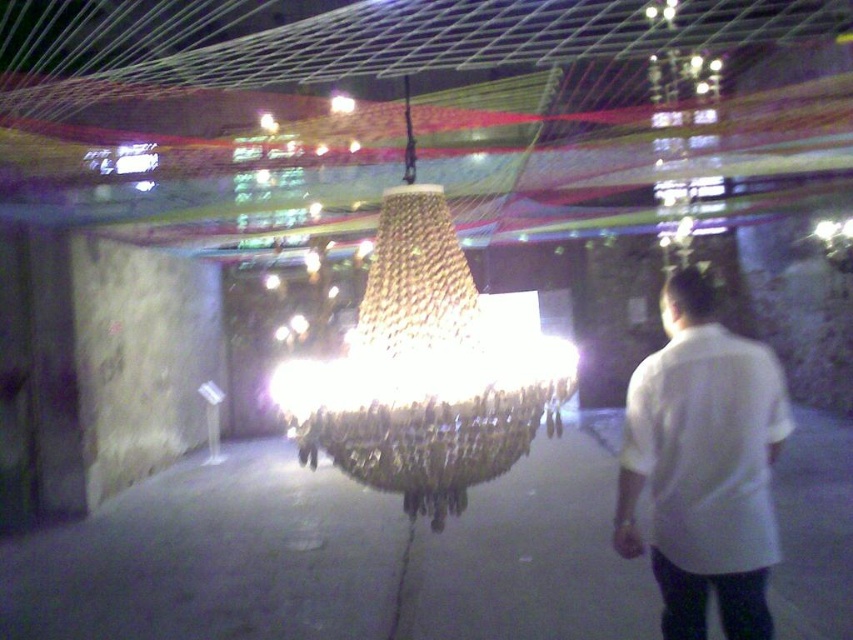
Question: Does iridescent glass chandelier at center appear on the right side of white cotton shirt at right?

Choices:
 (A) no
 (B) yes

Answer: (A)

Question: Does iridescent glass chandelier at center have a larger size compared to white cotton shirt at right?

Choices:
 (A) yes
 (B) no

Answer: (A)

Question: Does iridescent glass chandelier at center have a smaller size compared to white cotton shirt at right?

Choices:
 (A) no
 (B) yes

Answer: (A)

Question: Which of the following is the closest to the observer?

Choices:
 (A) white cotton shirt at right
 (B) iridescent glass chandelier at center

Answer: (B)

Question: Among these points, which one is farthest from the camera?

Choices:
 (A) (393, 385)
 (B) (709, 314)

Answer: (B)